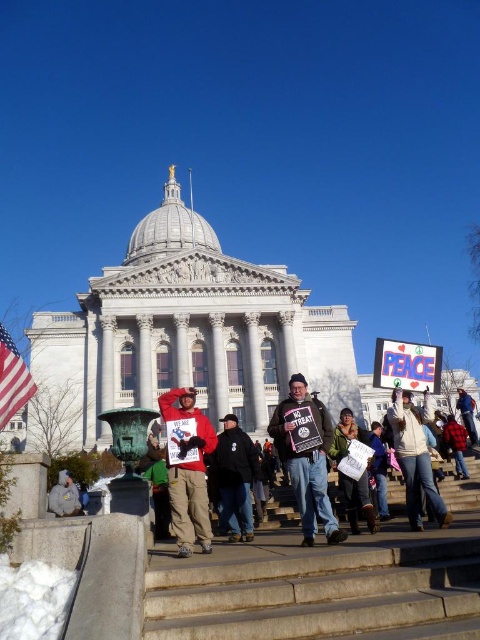
Can you confirm if red fleece jacket at center is shorter than white cotton shirt at center?

In fact, red fleece jacket at center may be taller than white cotton shirt at center.

Looking at this image, is red fleece jacket at center closer to the viewer compared to white cotton shirt at center?

Yes, red fleece jacket at center is closer to the viewer.

Is point (208, 451) positioned behind point (412, 412)?

No, it is not.

Locate an element on the screen. red fleece jacket at center is located at coordinates (189, 472).

Does black cotton jacket at center have a greater width compared to white paper sign at center?

No.

Which of these two, black cotton jacket at center or white paper sign at center, stands taller?

black cotton jacket at center

Between point (225, 504) and point (374, 531), which one is positioned in front?

Point (374, 531) is more forward.

Identify the location of black cotton jacket at center. (235, 477).

Is black cotton jacket at center taller than dark blue jacket at center?

Correct, black cotton jacket at center is much taller as dark blue jacket at center.

Find the location of a particular element. black cotton jacket at center is located at coordinates (235, 477).